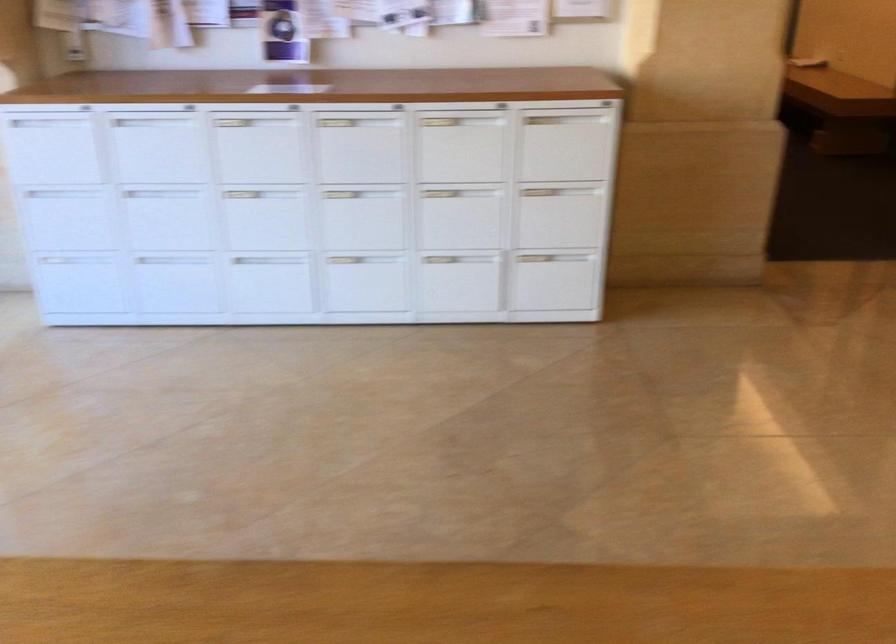
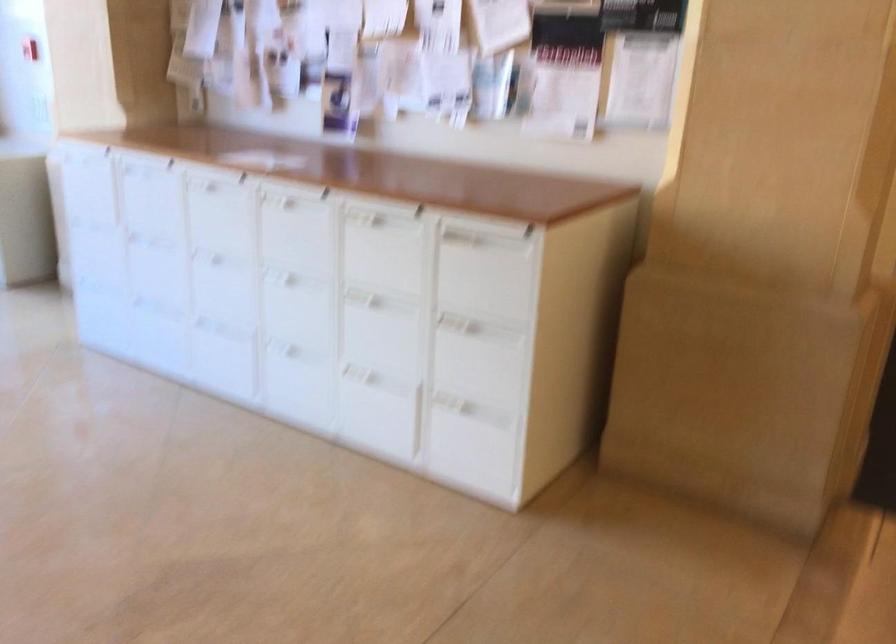
In the second image, find the point that corresponds to point 268,147 in the first image.

(220, 214)